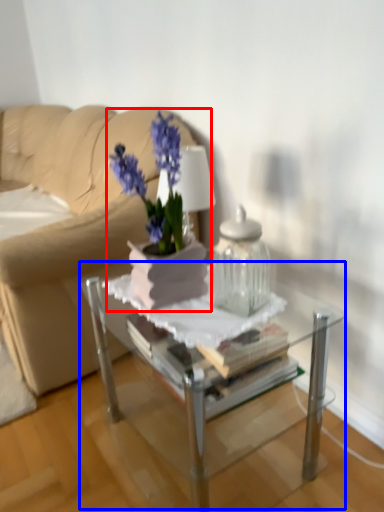
Question: Which object is closer to the camera taking this photo, houseplant (highlighted by a red box) or table (highlighted by a blue box)?

Choices:
 (A) houseplant
 (B) table

Answer: (B)